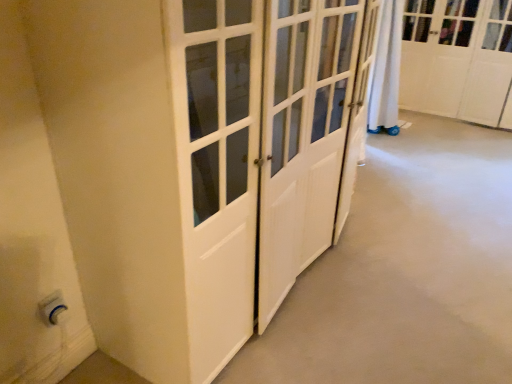
Locate an element on the screen. Image resolution: width=512 pixels, height=384 pixels. white plastic electric outlet at lower left is located at coordinates (52, 308).

What do you see at coordinates (52, 308) in the screenshot? Image resolution: width=512 pixels, height=384 pixels. I see `white plastic electric outlet at lower left` at bounding box center [52, 308].

This screenshot has width=512, height=384. I want to click on white glossy cabinet at upper right, so click(x=458, y=60).

This screenshot has height=384, width=512. What do you see at coordinates (458, 60) in the screenshot? I see `white glossy cabinet at upper right` at bounding box center [458, 60].

Measure the distance between point [451,59] and camera.

The distance of point [451,59] from camera is 13.40 feet.

Where is `white plastic electric outlet at lower left`? The width and height of the screenshot is (512, 384). white plastic electric outlet at lower left is located at coordinates (52, 308).

Is white plastic electric outlet at lower left at the right side of white glossy cabinet at upper right?

No.

Considering the positions of objects white plastic electric outlet at lower left and white glossy cabinet at upper right in the image provided, who is in front, white plastic electric outlet at lower left or white glossy cabinet at upper right?

Positioned in front is white plastic electric outlet at lower left.

Between point (45, 316) and point (501, 69), which one is positioned in front?

Point (45, 316)

From the image's perspective, who appears lower, white plastic electric outlet at lower left or white glossy cabinet at upper right?

white plastic electric outlet at lower left is shown below in the image.

From a real-world perspective, between white plastic electric outlet at lower left and white glossy cabinet at upper right, who is vertically higher?

white glossy cabinet at upper right.

Between white plastic electric outlet at lower left and white glossy cabinet at upper right, which one has smaller width?

white plastic electric outlet at lower left.

Which of these two, white plastic electric outlet at lower left or white glossy cabinet at upper right, stands taller?

white glossy cabinet at upper right.

Considering the sizes of white plastic electric outlet at lower left and white glossy cabinet at upper right in the image, is white plastic electric outlet at lower left bigger or smaller than white glossy cabinet at upper right?

white plastic electric outlet at lower left is smaller than white glossy cabinet at upper right.

Looking at this image, is white plastic electric outlet at lower left completely or partially outside of white glossy cabinet at upper right?

That's correct, white plastic electric outlet at lower left is outside of white glossy cabinet at upper right.

Are white plastic electric outlet at lower left and white glossy cabinet at upper right beside each other?

No, white plastic electric outlet at lower left is not next to white glossy cabinet at upper right.

Could you tell me if white plastic electric outlet at lower left is turned towards white glossy cabinet at upper right?

No, white plastic electric outlet at lower left is not aimed at white glossy cabinet at upper right.

At what (x,y) coordinates should I click in order to perform the action: click on cabinetry that appears on the right of white plastic electric outlet at lower left. Please return your answer as a coordinate pair (x, y). This screenshot has height=384, width=512. Looking at the image, I should click on (458, 60).

Considering the relative positions of white glossy cabinet at upper right and white plastic electric outlet at lower left in the image provided, is white glossy cabinet at upper right to the right of white plastic electric outlet at lower left from the viewer's perspective?

Yes, white glossy cabinet at upper right is to the right of white plastic electric outlet at lower left.

Considering the relative positions of white glossy cabinet at upper right and white plastic electric outlet at lower left in the image provided, is white glossy cabinet at upper right behind white plastic electric outlet at lower left?

Yes, white glossy cabinet at upper right is further from the camera.

Which is less distant, (437, 23) or (42, 309)?

Point (437, 23) is positioned farther from the camera compared to point (42, 309).

From the image's perspective, between white glossy cabinet at upper right and white plastic electric outlet at lower left, which one is located above?

white glossy cabinet at upper right, from the image's perspective.

From a real-world perspective, between white glossy cabinet at upper right and white plastic electric outlet at lower left, who is vertically higher?

white glossy cabinet at upper right, from a real-world perspective.

Between white glossy cabinet at upper right and white plastic electric outlet at lower left, which one has larger width?

With larger width is white glossy cabinet at upper right.

Does white glossy cabinet at upper right have a greater height compared to white plastic electric outlet at lower left?

Yes.

Does white glossy cabinet at upper right have a smaller size compared to white plastic electric outlet at lower left?

No.

Can we say white glossy cabinet at upper right lies outside white plastic electric outlet at lower left?

white glossy cabinet at upper right is positioned outside white plastic electric outlet at lower left.

Is white glossy cabinet at upper right not near white plastic electric outlet at lower left?

Yes, white glossy cabinet at upper right and white plastic electric outlet at lower left are quite far apart.

Based on the photo, is white glossy cabinet at upper right oriented towards white plastic electric outlet at lower left?

Yes, white glossy cabinet at upper right is turned towards white plastic electric outlet at lower left.

How different are the orientations of white glossy cabinet at upper right and white plastic electric outlet at lower left in degrees?

The facing directions of white glossy cabinet at upper right and white plastic electric outlet at lower left are 90.1 degrees apart.

Find the location of a particular element. Image resolution: width=512 pixels, height=384 pixels. electric outlet lying on the left of white glossy cabinet at upper right is located at coordinates (52, 308).

Locate an element on the screen. Image resolution: width=512 pixels, height=384 pixels. electric outlet lying in front of the white glossy cabinet at upper right is located at coordinates (52, 308).

Find the location of a particular element. electric outlet below the white glossy cabinet at upper right (from a real-world perspective) is located at coordinates (52, 308).